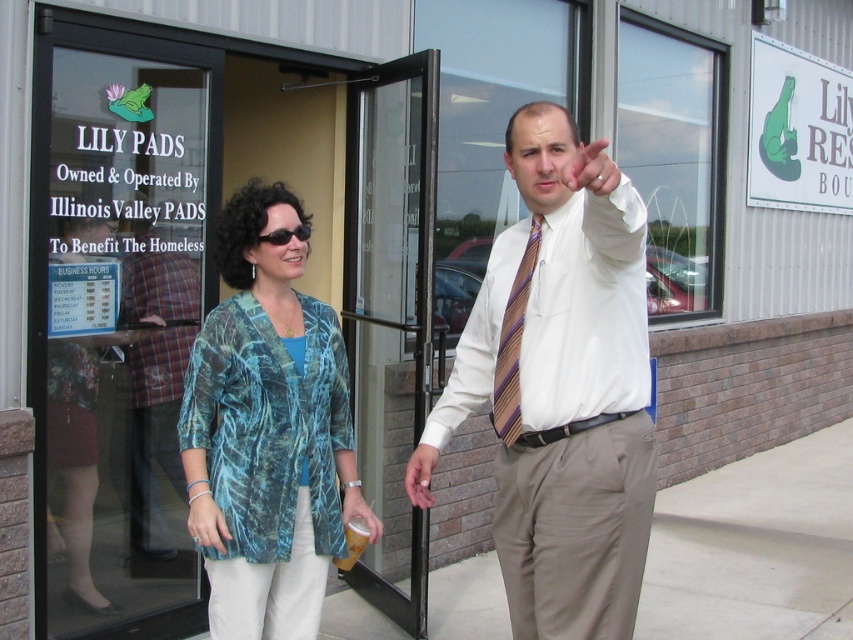
Does transparent glass door at upper left have a greater height compared to khaki cotton pants at right?

Yes, transparent glass door at upper left is taller than khaki cotton pants at right.

Who is higher up, transparent glass door at upper left or khaki cotton pants at right?

transparent glass door at upper left is above.

Where is `transparent glass door at upper left`? Image resolution: width=853 pixels, height=640 pixels. transparent glass door at upper left is located at coordinates (123, 324).

Locate an element on the screen. The height and width of the screenshot is (640, 853). transparent glass door at upper left is located at coordinates (123, 324).

Which is behind, point (614, 586) or point (582, 148)?

Positioned behind is point (614, 586).

Does khaki cotton pants at right appear under skinny striped tie at upper center?

Yes.

What do you see at coordinates (575, 529) in the screenshot?
I see `khaki cotton pants at right` at bounding box center [575, 529].

The image size is (853, 640). In order to click on khaki cotton pants at right in this screenshot , I will do `click(575, 529)`.

What do you see at coordinates (560, 394) in the screenshot? I see `white striped tie at center` at bounding box center [560, 394].

Describe the element at coordinates (560, 394) in the screenshot. The width and height of the screenshot is (853, 640). I see `white striped tie at center` at that location.

Where is `white striped tie at center`? This screenshot has height=640, width=853. white striped tie at center is located at coordinates point(560,394).